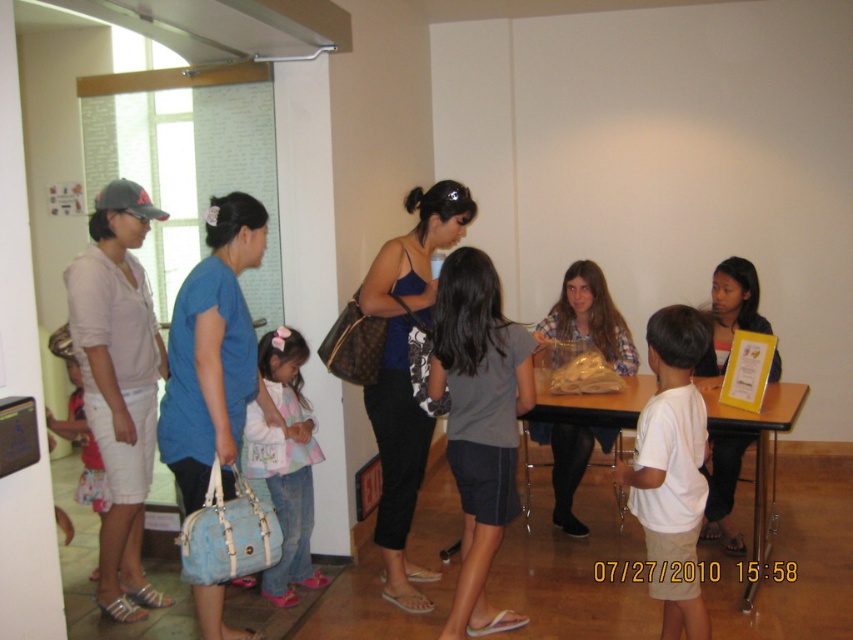
Question: Estimate the real-world distances between objects in this image. Which object is farther from the pastel striped shirt at center?

Choices:
 (A) plaid shirt at center
 (B) blue fabric purse at center
 (C) matte pink shirt at left
 (D) matte black shirt at center

Answer: (D)

Question: Is gray fabric shorts at center to the right of pastel striped shirt at center from the viewer's perspective?

Choices:
 (A) no
 (B) yes

Answer: (B)

Question: Is plaid shirt at center below matte black shirt at center?

Choices:
 (A) yes
 (B) no

Answer: (B)

Question: Among these points, which one is farthest from the camera?

Choices:
 (A) (154, 596)
 (B) (463, 396)
 (C) (547, 317)

Answer: (C)

Question: Which point appears farthest from the camera in this image?

Choices:
 (A) (389, 333)
 (B) (711, 467)

Answer: (B)

Question: Is pastel striped shirt at center below matte black shirt at center?

Choices:
 (A) yes
 (B) no

Answer: (A)